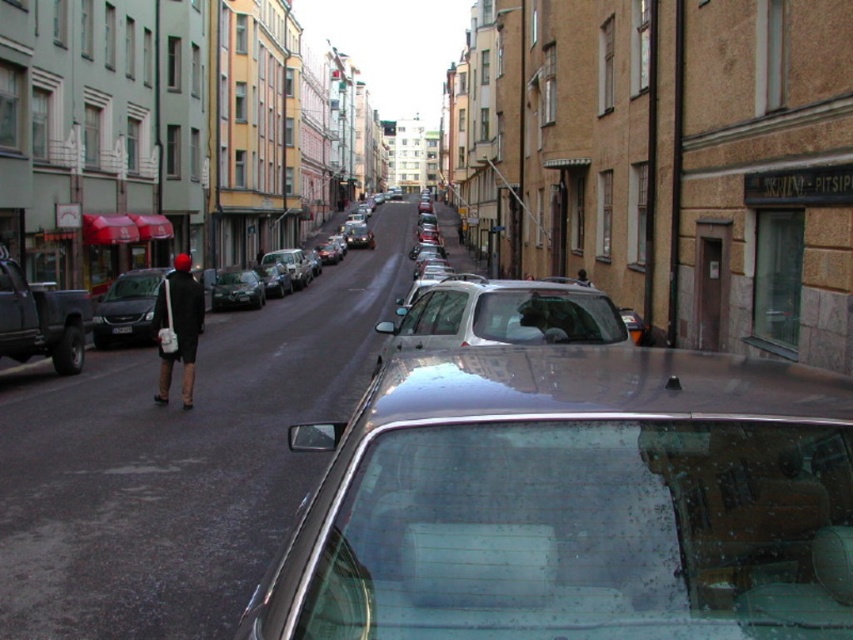
Can you confirm if metallic silver car at center is wider than shiny silver sedan at center?

Correct, the width of metallic silver car at center exceeds that of shiny silver sedan at center.

Where is `metallic silver car at center`? metallic silver car at center is located at coordinates (573, 502).

At what (x,y) coordinates should I click in order to perform the action: click on metallic silver car at center. Please return your answer as a coordinate pair (x, y). The width and height of the screenshot is (853, 640). Looking at the image, I should click on (573, 502).

Does point (730, 465) come behind point (250, 305)?

No, it is not.

Who is higher up, metallic silver car at center or shiny metallic car at center?

Positioned higher is shiny metallic car at center.

At what (x,y) coordinates should I click in order to perform the action: click on metallic silver car at center. Please return your answer as a coordinate pair (x, y). This screenshot has width=853, height=640. Looking at the image, I should click on (573, 502).

The width and height of the screenshot is (853, 640). I want to click on metallic silver car at center, so click(x=573, y=502).

Who is positioned more to the right, metallic silver car at center or white plastic license plate at center?

Positioned to the right is metallic silver car at center.

Between point (525, 573) and point (119, 326), which one is positioned in front?

Point (525, 573) is in front.

This screenshot has width=853, height=640. I want to click on metallic silver car at center, so click(573, 502).